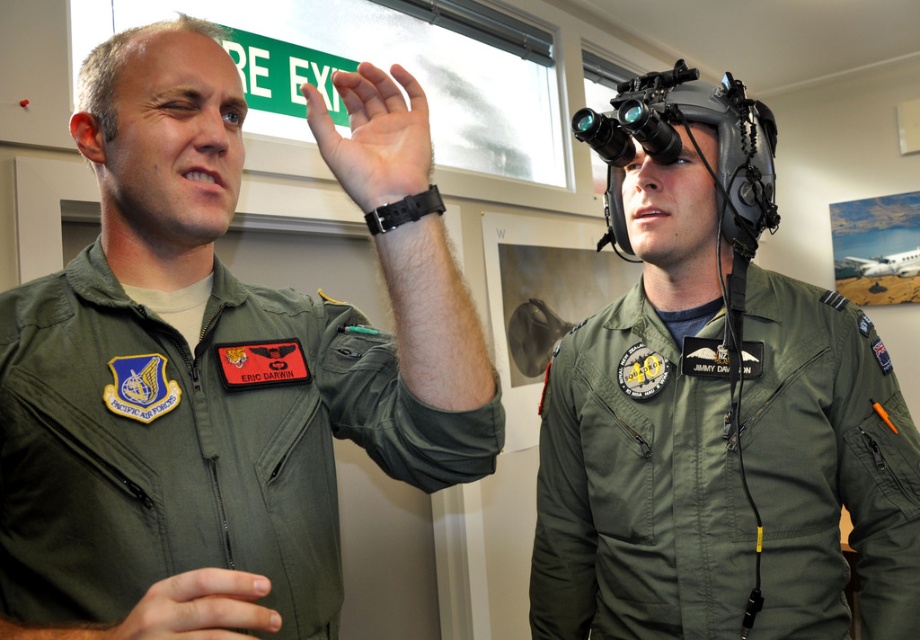
You are a photographer trying to capture a clear shot of both the matte gray helmet at center and the skinny black watch at upper center in the image. Since you want to ensure both are in focus, you need to know their heights relative to each other. Which object is taller?

The matte gray helmet at center is taller than the skinny black watch at upper center according to the description.